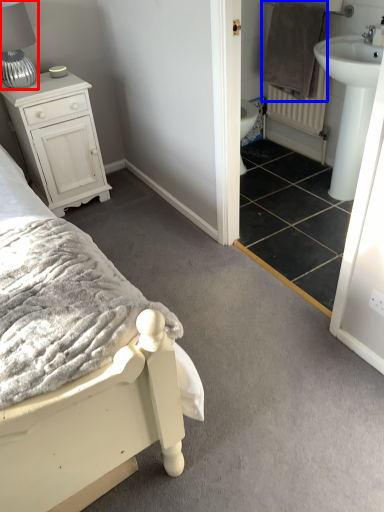
Question: Which object appears closest to the camera in this image, table lamp (highlighted by a red box) or blanket (highlighted by a blue box)?

Choices:
 (A) table lamp
 (B) blanket

Answer: (A)